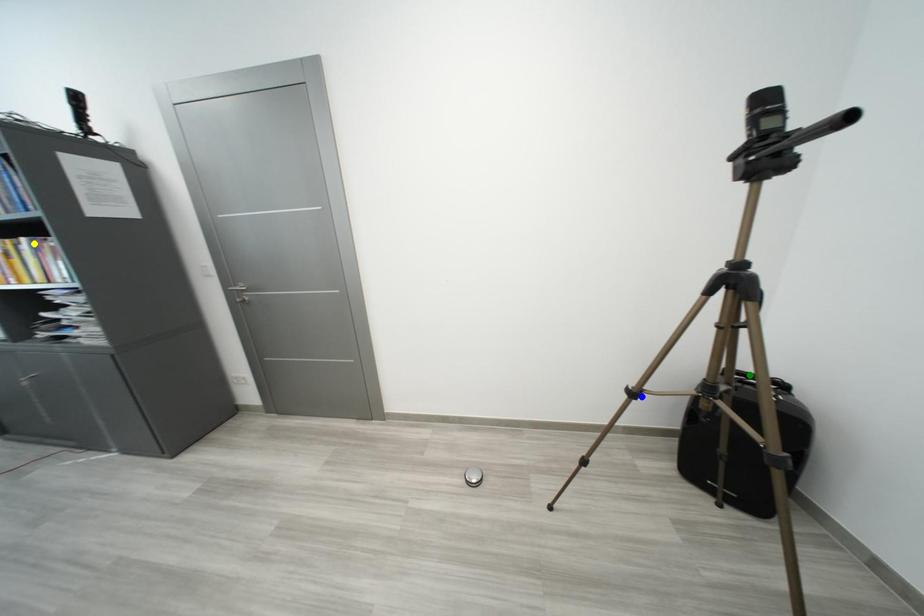
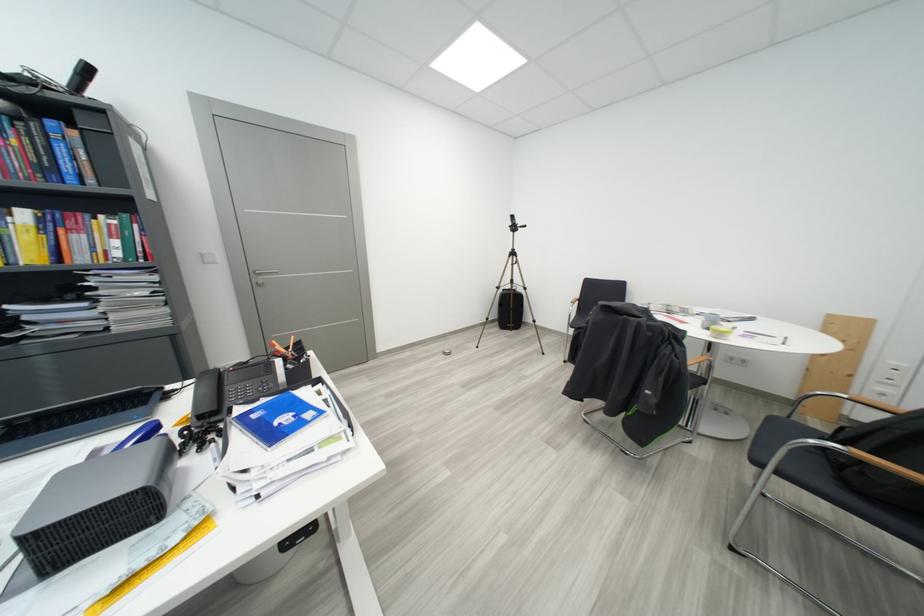
I am providing you with two images of the same scene from different viewpoints. Three points are marked in image1. Which point corresponds to a part or object that is occluded in image2?In image1, three points are marked. Which of them correspond to a part or object that is occluded in image2?Among the three points shown in image1, which one corresponds to a part or object that is no longer visible due to occlusion in image2?

green point